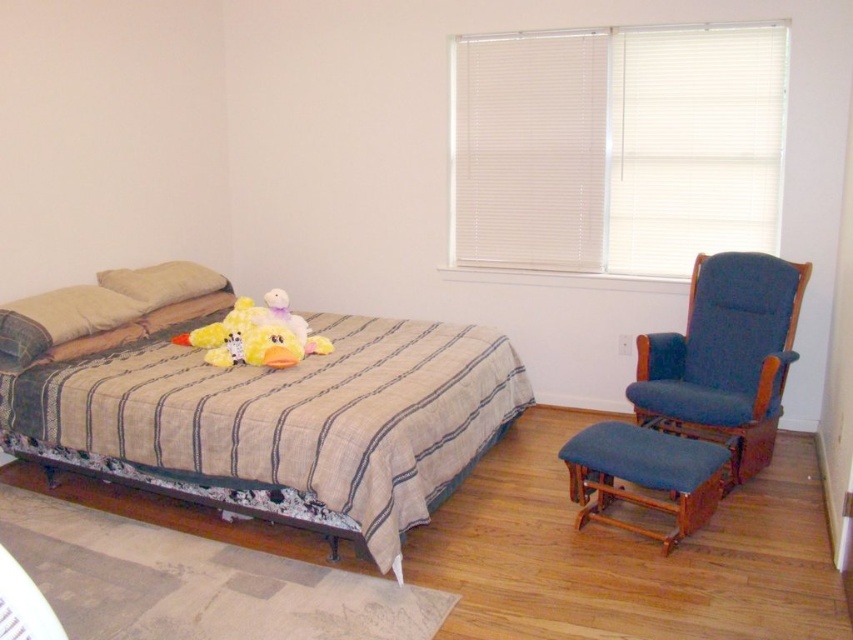
Question: Considering the relative positions of striped fabric bed at left and beige fabric pillow at upper left in the image provided, where is striped fabric bed at left located with respect to beige fabric pillow at upper left?

Choices:
 (A) below
 (B) above

Answer: (A)

Question: Which point is closer to the camera taking this photo?

Choices:
 (A) (158, 307)
 (B) (79, 396)

Answer: (B)

Question: Is the position of beige fabric pillow at left more distant than that of beige fabric pillow at upper left?

Choices:
 (A) no
 (B) yes

Answer: (A)

Question: Can you confirm if blue fabric stool at lower right is positioned to the right of beige fabric pillow at left?

Choices:
 (A) no
 (B) yes

Answer: (B)

Question: Among these points, which one is nearest to the camera?

Choices:
 (A) (242, 300)
 (B) (467, 346)
 (C) (692, 369)
 (D) (113, 308)

Answer: (B)

Question: Estimate the real-world distances between objects in this image. Which object is farther from the blue fabric rocking chair at right?

Choices:
 (A) blue fabric stool at lower right
 (B) beige fabric pillow at left
 (C) striped fabric bed at left

Answer: (B)